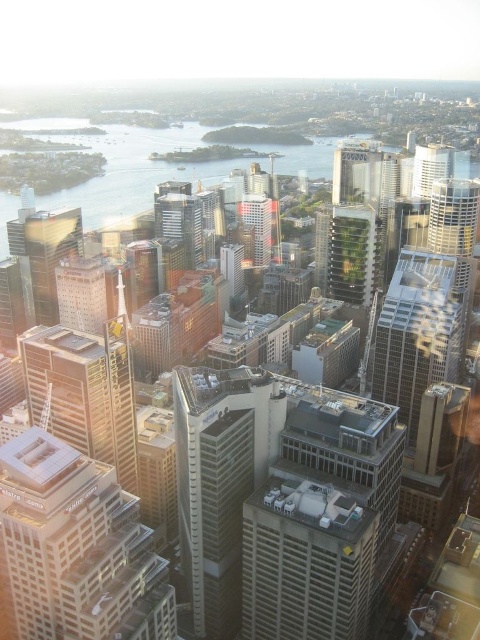
You are a city planner reviewing the aerial view of the city. You need to determine which of the two buildings, the white glass building at center or the matte glass skyscraper at center, has a greater height. Based on the provided information, which one is taller?

The white glass building at center is much taller than the matte glass skyscraper at center, so the white glass building at center is the taller one.

You are a drone operator trying to capture a photo of the city from above. You notice two points in the image labeled as point 1 at coordinates point (97, 582) and point 2 at coordinates point (392, 349). Which point should you focus on to ensure it appears larger in your photo?

Point 1 at coordinates point (97, 582) should be focused on because it is closer to the camera, making it appear larger in the photo compared to point 2 at coordinates point (392, 349) which is further away.

You are a drone operator tasked with capturing aerial footage of the city. Your drone is currently at coordinates 0.5, 0.5. You need to fly to the white glass building at center. What direction should you fly to reach it?

The white glass building at center is located at coordinates (78, 547). Since your current position is (240, 320), you should fly northeast to reach it.